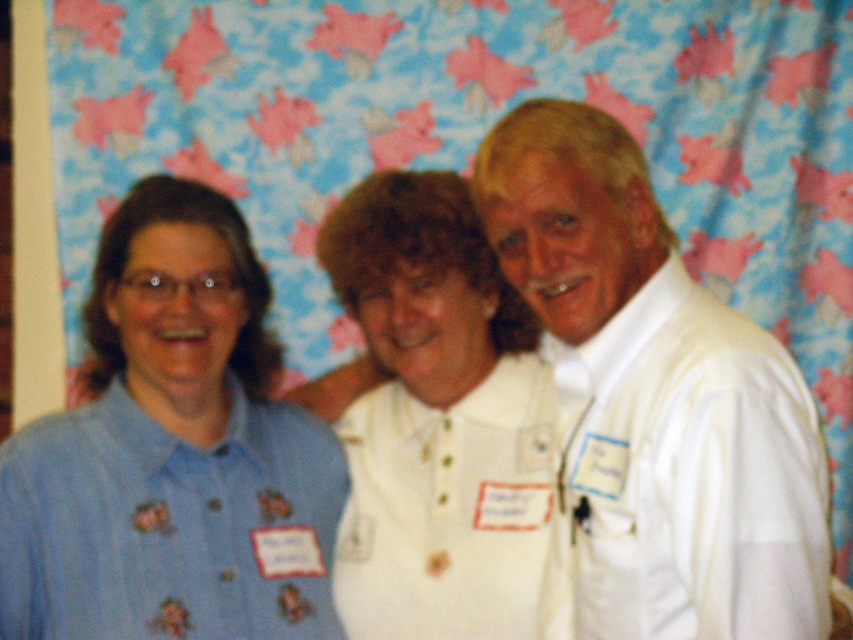
Question: Considering the real-world distances, which object is closest to the white cotton shirt at center?

Choices:
 (A) white satin shirt at right
 (B) blue cotton shirt at left

Answer: (B)

Question: Where is blue cotton shirt at left located in relation to white satin shirt at right in the image?

Choices:
 (A) right
 (B) left

Answer: (B)

Question: Can you confirm if blue cotton shirt at left is positioned above white satin shirt at right?

Choices:
 (A) yes
 (B) no

Answer: (A)

Question: Can you confirm if blue cotton shirt at left is wider than white satin shirt at right?

Choices:
 (A) yes
 (B) no

Answer: (A)

Question: Which object is closer to the camera taking this photo?

Choices:
 (A) white cotton shirt at center
 (B) blue cotton shirt at left

Answer: (B)

Question: Which of the following is the closest to the observer?

Choices:
 (A) (279, 452)
 (B) (602, 456)
 (C) (409, 625)

Answer: (B)